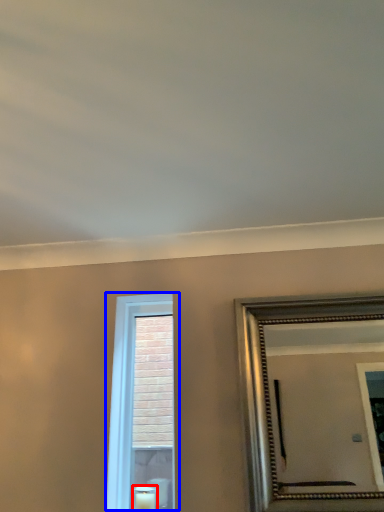
Question: Which of the following is the farthest to the observer, candle (highlighted by a red box) or window (highlighted by a blue box)?

Choices:
 (A) candle
 (B) window

Answer: (B)